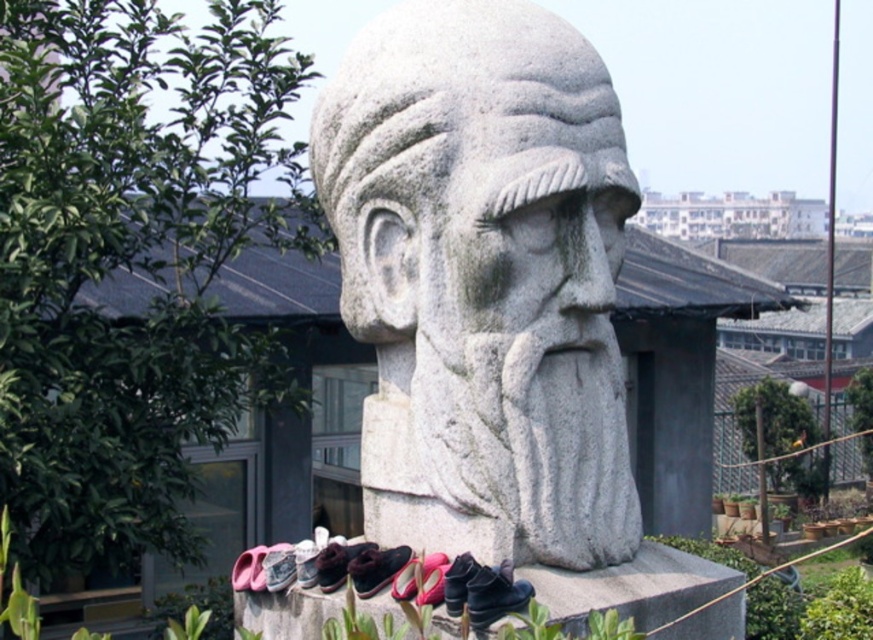
Can you confirm if leather shoe at center is wider than pink fabric shoe at lower center?

In fact, leather shoe at center might be narrower than pink fabric shoe at lower center.

The height and width of the screenshot is (640, 873). What do you see at coordinates (278, 566) in the screenshot? I see `leather shoe at center` at bounding box center [278, 566].

Is point (282, 586) positioned behind point (239, 556)?

No, (282, 586) is in front of (239, 556).

Locate an element on the screen. This screenshot has width=873, height=640. leather shoe at center is located at coordinates (278, 566).

Is point (540, 388) farther from camera compared to point (514, 598)?

Yes, point (540, 388) is behind point (514, 598).

Is white stone bust at center positioned behind black leather shoe at lower center?

Yes, white stone bust at center is behind black leather shoe at lower center.

You are a GUI agent. You are given a task and a screenshot of the screen. Output one action in this format:
    pyautogui.click(x=<x>, y=<y>)
    Task: Click on the white stone bust at center
    
    Given the screenshot: What is the action you would take?
    pyautogui.click(x=483, y=280)

Does matte black shoe at center appear on the right side of brown leather shoe at lower center?

Yes, matte black shoe at center is to the right of brown leather shoe at lower center.

Describe the element at coordinates (376, 568) in the screenshot. I see `matte black shoe at center` at that location.

Identify the location of matte black shoe at center. (376, 568).